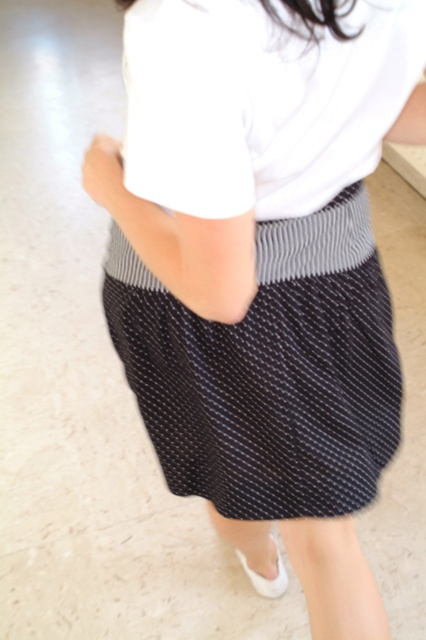
Question: Is black textured skirt at center bigger than white cotton shirt at center?

Choices:
 (A) no
 (B) yes

Answer: (B)

Question: Which point is closer to the camera?

Choices:
 (A) (157, 374)
 (B) (239, 77)

Answer: (B)

Question: Does black textured skirt at center appear on the right side of white cotton shirt at center?

Choices:
 (A) yes
 (B) no

Answer: (B)

Question: Which point is farther to the camera?

Choices:
 (A) (348, 100)
 (B) (253, 516)

Answer: (B)

Question: Can you confirm if black textured skirt at center is smaller than white cotton shirt at center?

Choices:
 (A) yes
 (B) no

Answer: (B)